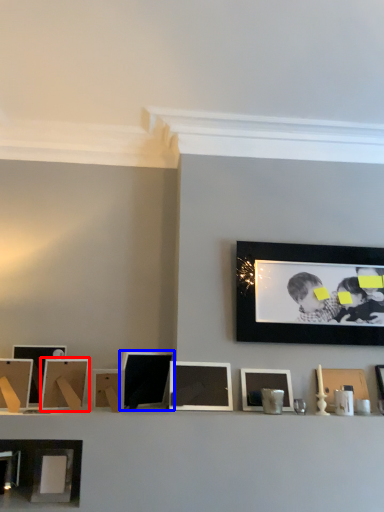
Question: Which point is closer to the camera, picture frame (highlighted by a red box) or picture frame (highlighted by a blue box)?

Choices:
 (A) picture frame
 (B) picture frame

Answer: (A)